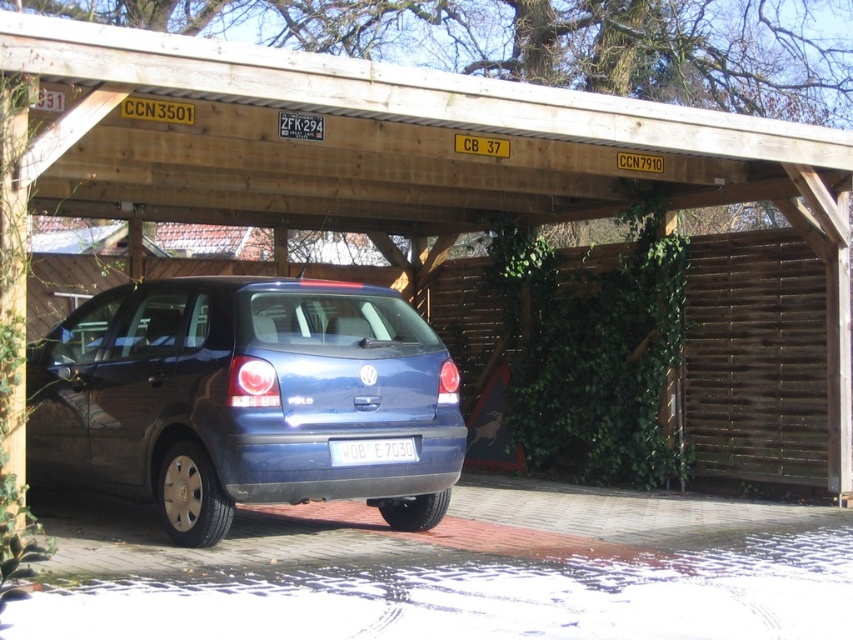
You are standing at the entrance of the wooden carport and want to park your car directly in front of the matte blue hatchback at center. What coordinates should you aim for to position your car correctly?

You should aim for the coordinates point (244, 397) to position your car directly in front of the matte blue hatchback at center.

You are standing in front of the carport and want to place a small plant pot between the two points marked as point (416, 332) and point (334, 456). Which point should the pot be closer to in order to be nearer to the Volkswagen Polo parked underneath?

The plant pot should be placed closer to point (334, 456) because it is closer to the Volkswagen Polo parked underneath. Since point (416, 332) is further away from the viewer than point (334, 456), the latter is nearer to the car.